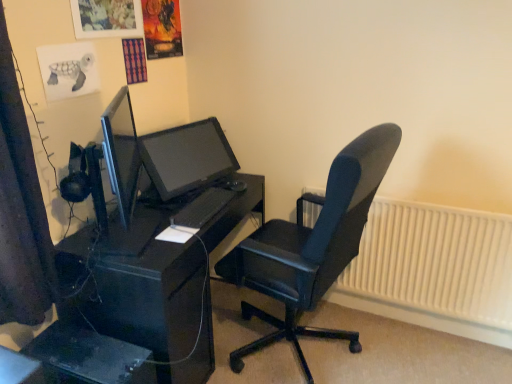
At what (x,y) coordinates should I click in order to perform the action: click on vacant space to the left of white plastic radiator at right. Please return your answer as a coordinate pair (x, y). Looking at the image, I should click on (312, 335).